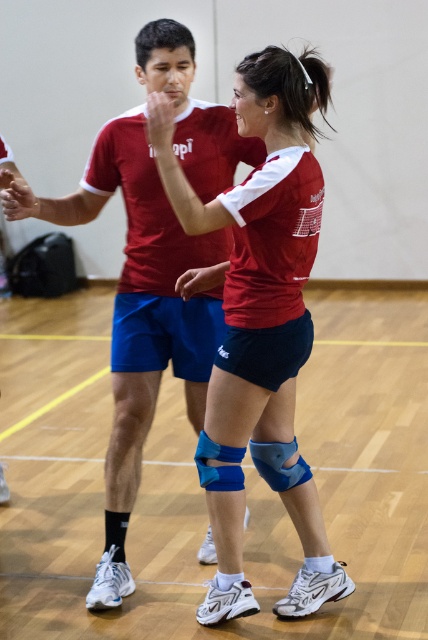
From the picture: Is blue matte knee pads at center positioned behind matte red shirt at center?

No, blue matte knee pads at center is closer to the viewer.

Does blue matte knee pads at center appear on the left side of matte red shirt at center?

Incorrect, blue matte knee pads at center is not on the left side of matte red shirt at center.

Does point (312, 248) come in front of point (154, 186)?

Yes, point (312, 248) is in front of point (154, 186).

At what (x,y) coordinates should I click in order to perform the action: click on blue matte knee pads at center. Please return your answer as a coordinate pair (x, y). Looking at the image, I should click on (261, 323).